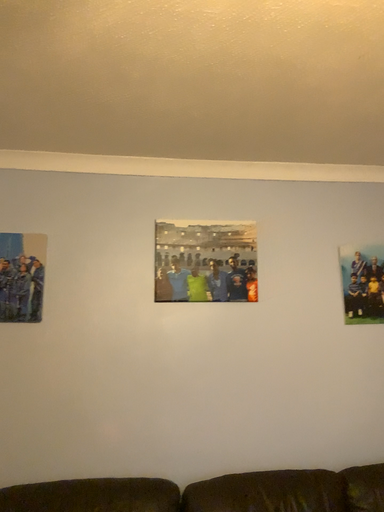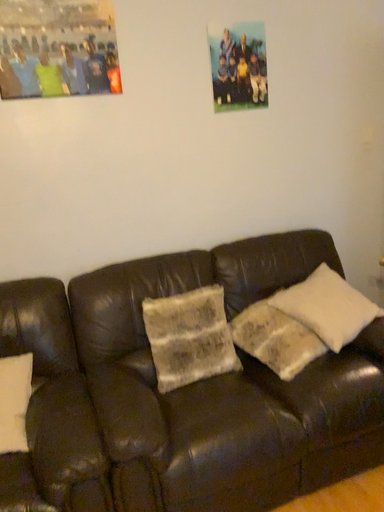
Question: How did the camera likely rotate when shooting the video?

Choices:
 (A) rotated downward
 (B) rotated upward

Answer: (A)